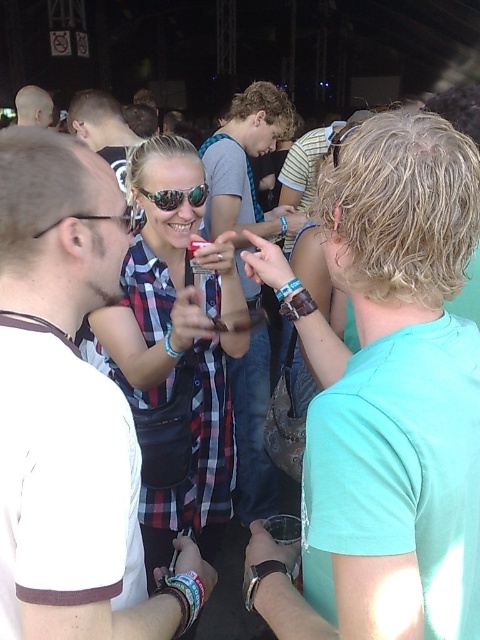
Question: Does denim jeans at center appear over matte black sunglasses at upper left?

Choices:
 (A) yes
 (B) no

Answer: (A)

Question: Is teal fabric shirt at center positioned behind matte black hair at upper left?

Choices:
 (A) yes
 (B) no

Answer: (B)

Question: Which object is the closest to the plaid shirt at center?

Choices:
 (A) matte black sunglasses at upper center
 (B) shiny reflective sunglasses at center
 (C) matte black sunglasses at upper left

Answer: (B)

Question: Which of the following is the farthest from the observer?

Choices:
 (A) (342, 493)
 (B) (21, 122)
 (C) (354, 122)
 (D) (181, 486)

Answer: (B)

Question: Which object is closer to the camera taking this photo?

Choices:
 (A) plaid shirt at center
 (B) matte black hair at upper left

Answer: (A)

Question: Is teal fabric shirt at center smaller than denim jeans at center?

Choices:
 (A) yes
 (B) no

Answer: (A)